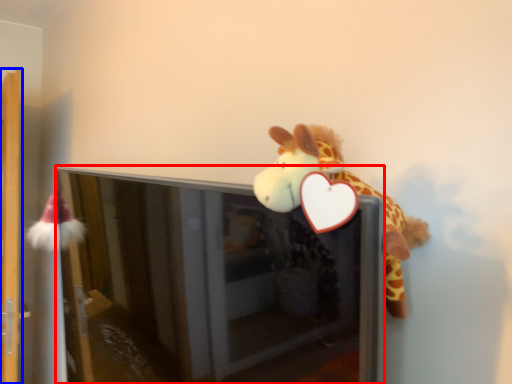
Question: Which of the following is the farthest to the observer, screen door (highlighted by a red box) or shelf (highlighted by a blue box)?

Choices:
 (A) screen door
 (B) shelf

Answer: (B)